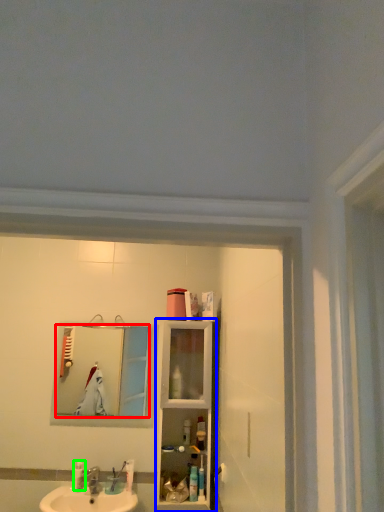
Question: Based on their relative distances, which object is farther from mirror (highlighted by a red box)? Choose from cabinet (highlighted by a blue box) and toiletry (highlighted by a green box).

Choices:
 (A) cabinet
 (B) toiletry

Answer: (A)